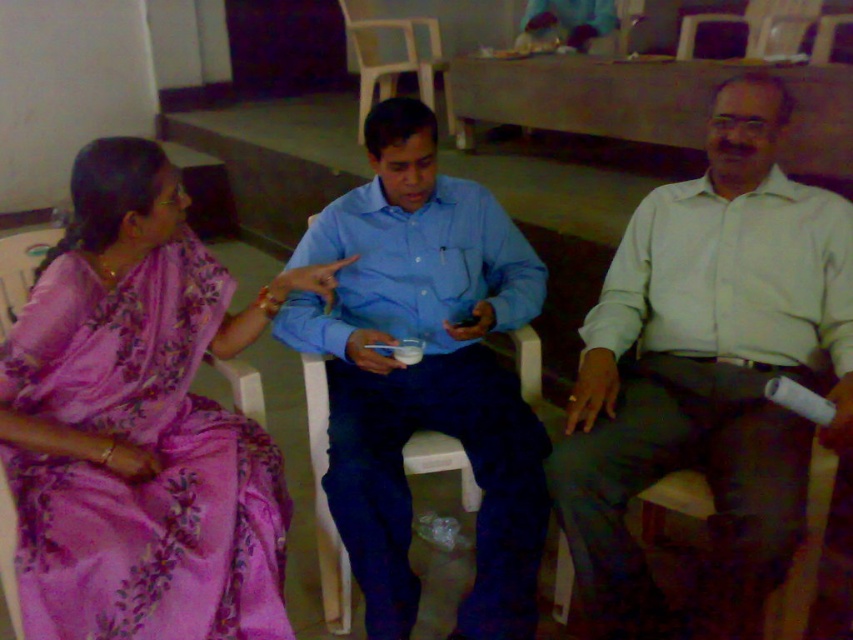
Does light beige shirt at right appear on the left side of white plastic chair at center?

In fact, light beige shirt at right is to the right of white plastic chair at center.

Does point (834, 337) come closer to viewer compared to point (409, 22)?

Yes, it is in front of point (409, 22).

Find the location of a particular element. The height and width of the screenshot is (640, 853). light beige shirt at right is located at coordinates (711, 365).

How distant is blue cotton shirt at center from white plastic chair at center?

They are 2.70 meters apart.

Between point (358, 317) and point (387, 84), which one is positioned in front?

Positioned in front is point (358, 317).

Describe the element at coordinates (425, 372) in the screenshot. I see `blue cotton shirt at center` at that location.

Where is `blue cotton shirt at center`? The image size is (853, 640). blue cotton shirt at center is located at coordinates (425, 372).

Is pink satin saree at left positioned in front of blue cotton shirt at center?

Yes, it is.

Does point (180, 317) come farther from viewer compared to point (317, 218)?

That is False.

Image resolution: width=853 pixels, height=640 pixels. In order to click on pink satin saree at left in this screenshot , I will do `click(138, 422)`.